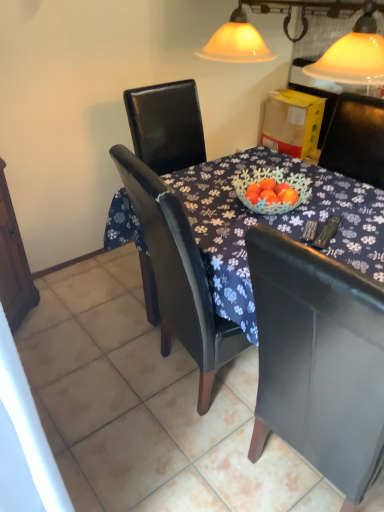
Question: Does dark wood table at center come behind black leather chair at center?

Choices:
 (A) no
 (B) yes

Answer: (B)

Question: Is dark wood table at center touching black leather chair at center?

Choices:
 (A) yes
 (B) no

Answer: (B)

Question: Does dark wood table at center have a greater height compared to black leather chair at center?

Choices:
 (A) no
 (B) yes

Answer: (A)

Question: Is dark wood table at center at the left side of black leather chair at center?

Choices:
 (A) yes
 (B) no

Answer: (A)

Question: Would you say dark wood table at center contains black leather chair at center?

Choices:
 (A) yes
 (B) no

Answer: (B)

Question: Is dark wood table at center smaller than black leather chair at center?

Choices:
 (A) yes
 (B) no

Answer: (B)

Question: Could dark wood table at center be considered to be inside black leather chair at center?

Choices:
 (A) no
 (B) yes

Answer: (A)

Question: Is dark wood table at center at the back of black leather chair at center?

Choices:
 (A) no
 (B) yes

Answer: (A)

Question: Would you say black leather chair at center is a long distance from dark wood table at center?

Choices:
 (A) no
 (B) yes

Answer: (A)

Question: Does black leather chair at center have a lesser height compared to dark wood table at center?

Choices:
 (A) yes
 (B) no

Answer: (B)

Question: From the image's perspective, does black leather chair at center appear lower than dark wood table at center?

Choices:
 (A) no
 (B) yes

Answer: (B)

Question: Can you confirm if black leather chair at center is wider than dark wood table at center?

Choices:
 (A) yes
 (B) no

Answer: (B)

Question: In the image, is black leather chair at center positioned in front of or behind dark wood table at center?

Choices:
 (A) front
 (B) behind

Answer: (A)